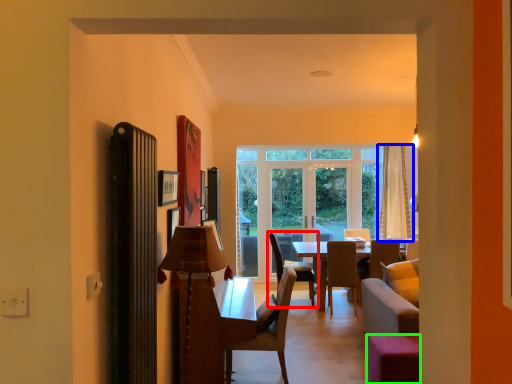
Question: Which object is positioned farthest from chair (highlighted by a red box)? Select from curtain (highlighted by a blue box) and stool (highlighted by a green box).

Choices:
 (A) curtain
 (B) stool

Answer: (B)